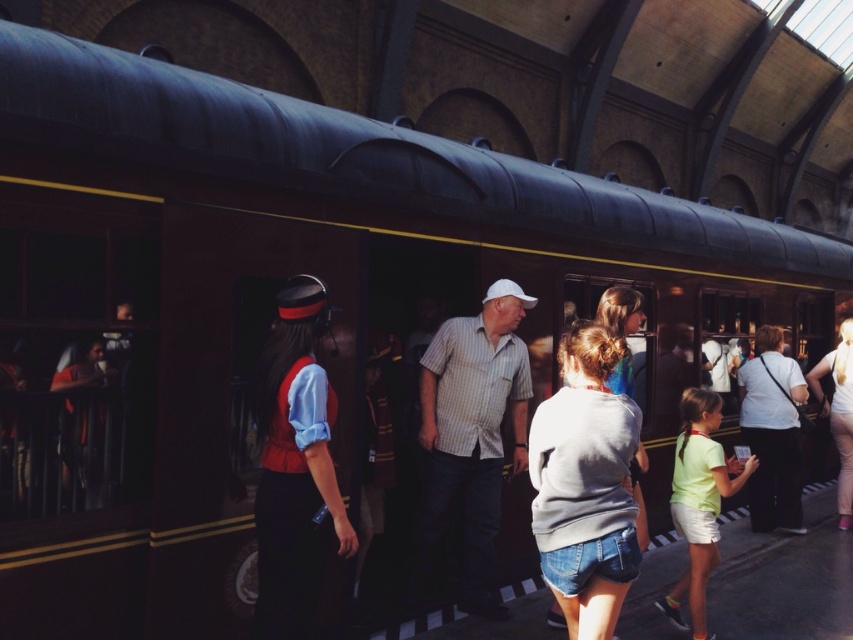
You are a photographer at the train station and want to capture both the matte red vest at center and the striped cotton shirt at center in a single shot. Based on their heights, which clothing item will appear shorter in the photo?

The matte red vest at center will appear shorter in the photo since it is not as tall as the striped cotton shirt at center.